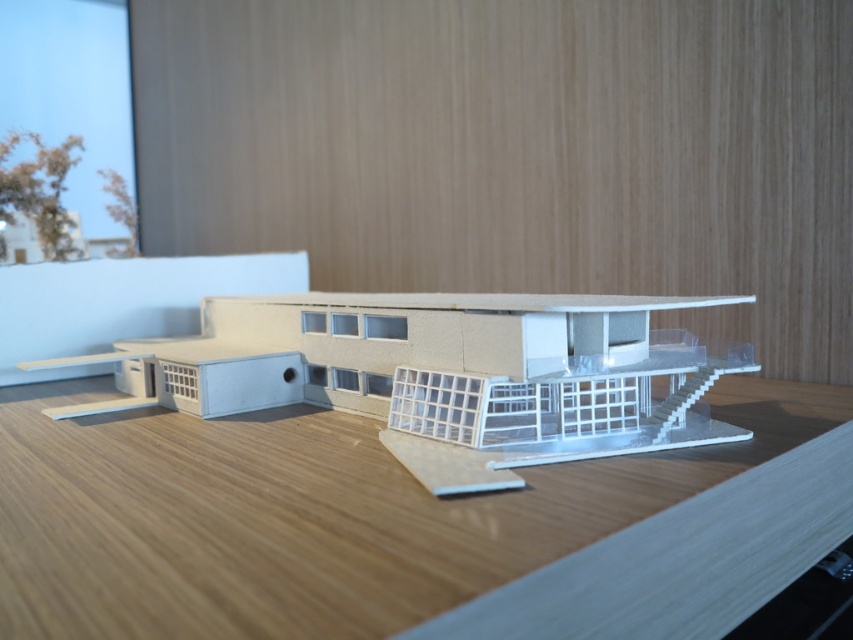
Question: Among these points, which one is farthest from the camera?

Choices:
 (A) (160, 390)
 (B) (461, 531)

Answer: (A)

Question: Is wooden table at center bigger than white matte building at center?

Choices:
 (A) no
 (B) yes

Answer: (B)

Question: Can you confirm if wooden table at center is positioned to the right of white matte building at center?

Choices:
 (A) yes
 (B) no

Answer: (A)

Question: Does wooden table at center lie in front of white matte building at center?

Choices:
 (A) yes
 (B) no

Answer: (A)